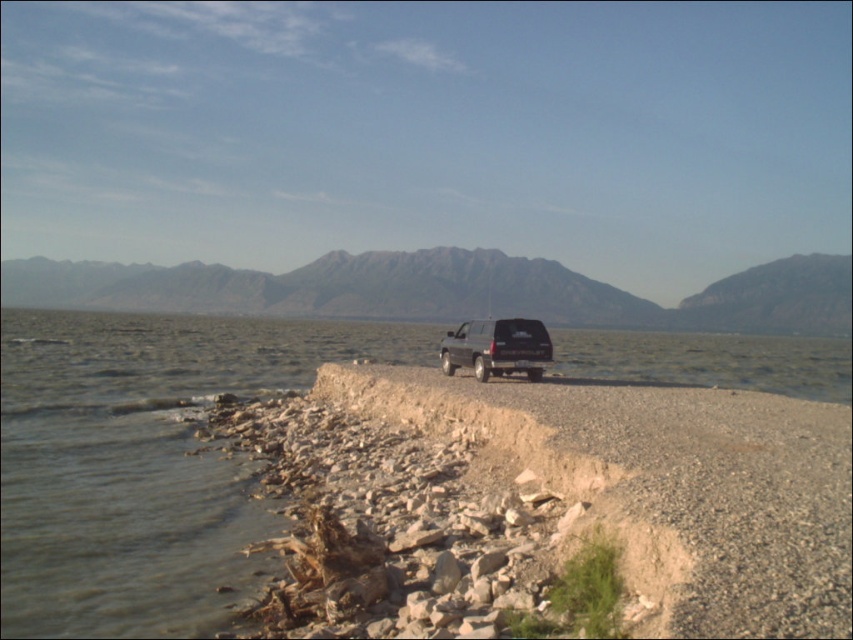
Question: Which of the following is the closest to the observer?

Choices:
 (A) rugged granite mountain at center
 (B) shiny black suv at center
 (C) clear water at shore right

Answer: (C)

Question: Which point is farther to the camera?

Choices:
 (A) pos(42,304)
 (B) pos(468,364)

Answer: (A)

Question: Which point appears closest to the camera in this image?

Choices:
 (A) (109, 356)
 (B) (210, 291)
 (C) (543, 360)

Answer: (C)

Question: Does clear water at shore right come behind rugged granite mountain at center?

Choices:
 (A) no
 (B) yes

Answer: (A)

Question: Does clear water at shore right have a larger size compared to rugged granite mountain at center?

Choices:
 (A) no
 (B) yes

Answer: (A)

Question: Where is clear water at shore right located in relation to shiny black suv at center in the image?

Choices:
 (A) below
 (B) above

Answer: (B)